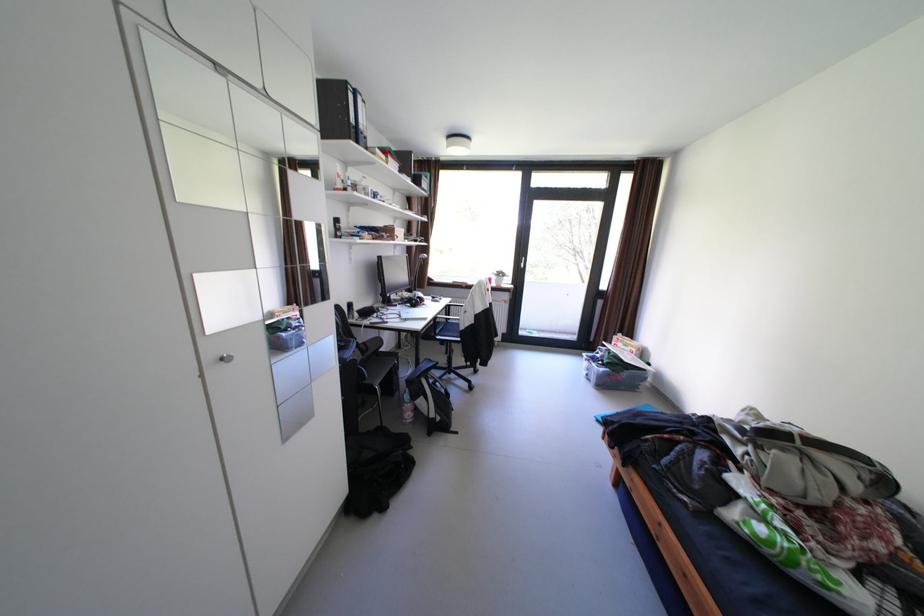
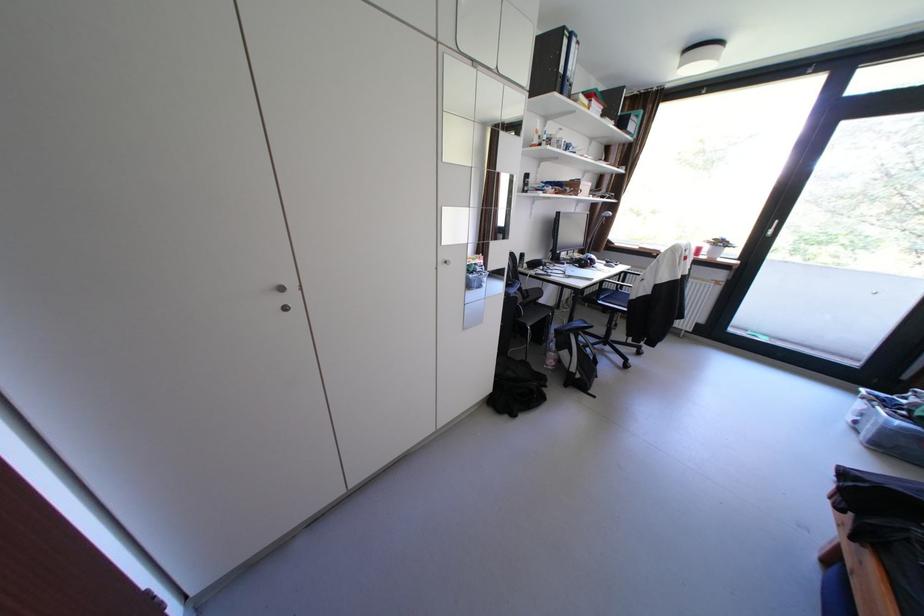
The point at (450, 323) is marked in the first image. Where is the corresponding point in the second image?

(617, 290)